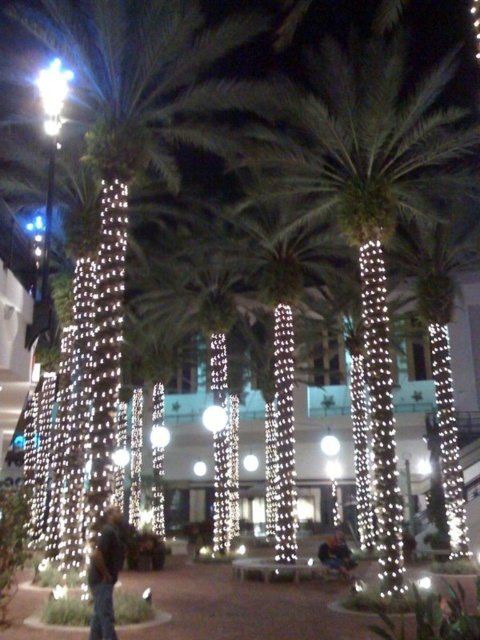
Question: Does illuminated white palm tree at center appear on the left side of illuminated string lights at center?

Choices:
 (A) no
 (B) yes

Answer: (B)

Question: Which of the following is the closest to the observer?

Choices:
 (A) dark blue jeans at center
 (B) illuminated string lights at center

Answer: (A)

Question: Does green leafy palm tree at center appear over illuminated white palm tree at center?

Choices:
 (A) no
 (B) yes

Answer: (B)

Question: Which object appears farthest from the camera in this image?

Choices:
 (A) illuminated string lights at center
 (B) green leafy palm tree at center
 (C) illuminated white palm tree at center
 (D) dark blue jeans at center

Answer: (C)

Question: Does green leafy palm tree at center have a larger size compared to dark blue jeans at center?

Choices:
 (A) yes
 (B) no

Answer: (A)

Question: Which point is closer to the camera taking this photo?

Choices:
 (A) (101, 547)
 (B) (465, 257)
 (C) (313, 234)

Answer: (A)